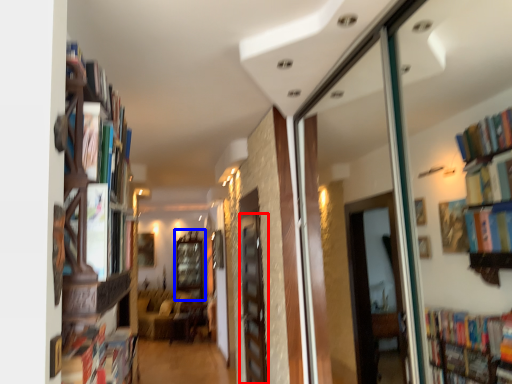
Question: Which object appears closest to the camera in this image, screen door (highlighted by a red box) or window (highlighted by a blue box)?

Choices:
 (A) screen door
 (B) window

Answer: (A)